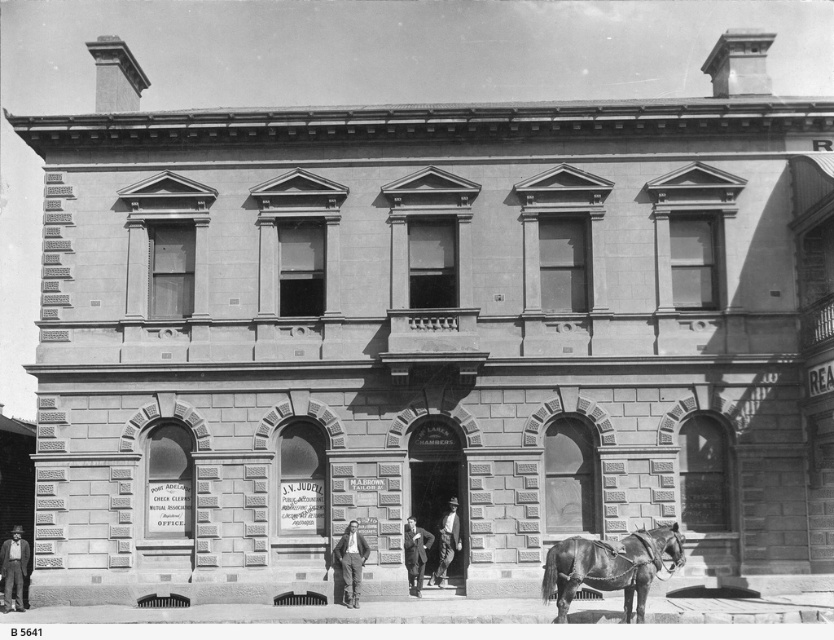
Question: Considering the relative positions of shiny brown horse at lower right and light brown leather coat at center in the image provided, where is shiny brown horse at lower right located with respect to light brown leather coat at center?

Choices:
 (A) above
 (B) below

Answer: (A)

Question: Is shiny brown horse at lower right in front of dark brown leather hat at lower left?

Choices:
 (A) yes
 (B) no

Answer: (A)

Question: Which object appears closest to the camera in this image?

Choices:
 (A) dark suit at center
 (B) light brown leather coat at center
 (C) dark gray suit at center
 (D) dark brown leather hat at lower left

Answer: (C)

Question: Does dark gray suit at center appear on the left side of light brown leather coat at center?

Choices:
 (A) yes
 (B) no

Answer: (A)

Question: Which point is farther to the camera?

Choices:
 (A) dark suit at center
 (B) dark gray suit at center

Answer: (A)

Question: Which point appears closest to the camera in this image?

Choices:
 (A) (4, 595)
 (B) (352, 604)
 (C) (404, 532)

Answer: (B)